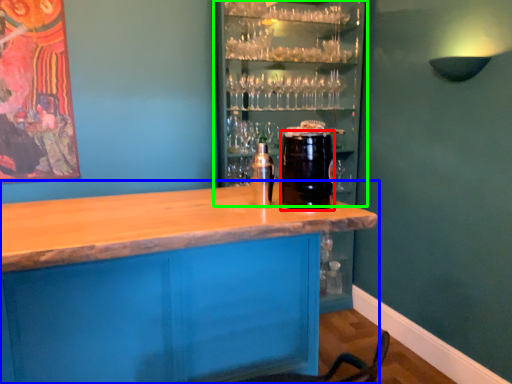
Question: Which is farther away from beverage (highlighted by a red box)? table (highlighted by a blue box) or shelf (highlighted by a green box)?

Choices:
 (A) table
 (B) shelf

Answer: (B)